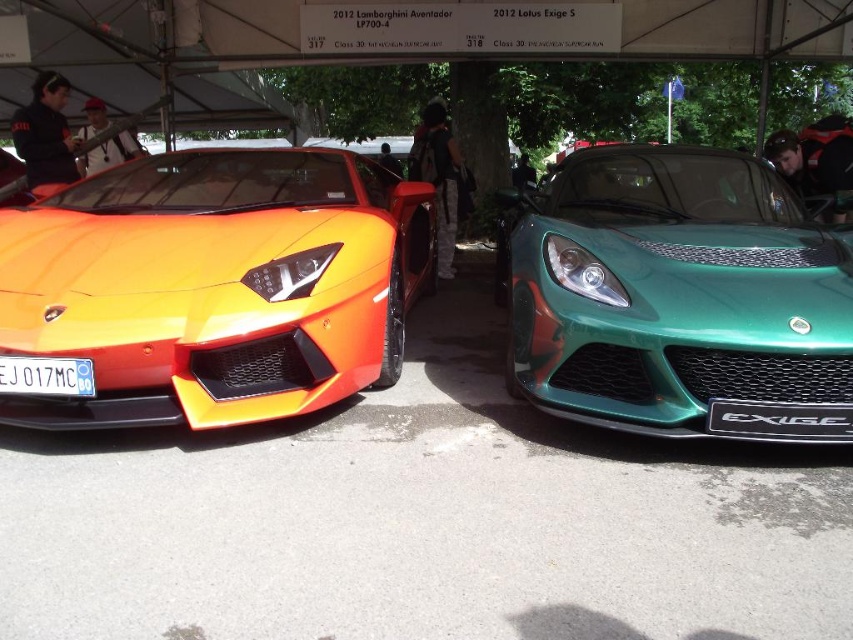
Question: From the image, what is the correct spatial relationship of orange matte/satin lamborghini aventador at left in relation to black matte at center?

Choices:
 (A) right
 (B) left

Answer: (B)

Question: Is orange matte sports car at left wider than metallic green sports car at right?

Choices:
 (A) no
 (B) yes

Answer: (B)

Question: Which point is farther from the camera taking this photo?

Choices:
 (A) (281, 179)
 (B) (13, 388)
 (C) (399, 264)

Answer: (A)

Question: Which of the following is the closest to the observer?

Choices:
 (A) orange matte/satin lamborghini aventador at left
 (B) white plastic license plate at center
 (C) orange matte sports car at left

Answer: (C)

Question: Based on their relative distances, which object is farther from the orange matte sports car at left?

Choices:
 (A) orange matte/satin lamborghini aventador at left
 (B) white plastic license plate at center
 (C) black matte at center

Answer: (C)

Question: Can you confirm if orange matte sports car at left is smaller than black matte at center?

Choices:
 (A) no
 (B) yes

Answer: (A)